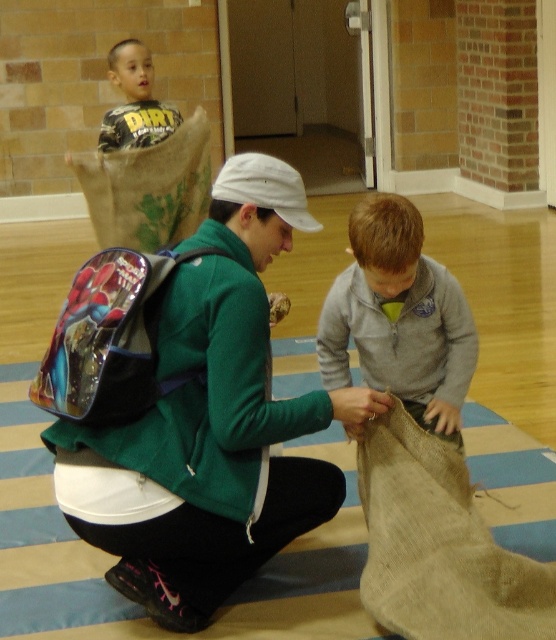
Question: Is green fabric backpack at center wider than gray fleece sweater at center?

Choices:
 (A) yes
 (B) no

Answer: (A)

Question: Which of the following is the farthest from the observer?

Choices:
 (A) (172, 129)
 (B) (358, 216)
 (C) (118, 337)
 (D) (212, 380)

Answer: (A)

Question: Which object appears closest to the camera in this image?

Choices:
 (A) matte yellow shirt at upper left
 (B) gray fleece sweater at center
 (C) shiny blue backpack at center

Answer: (C)

Question: Which object is closer to the camera taking this photo?

Choices:
 (A) gray fleece sweater at center
 (B) green fabric backpack at center
 (C) matte yellow shirt at upper left
 (D) shiny blue backpack at center

Answer: (D)

Question: Can you confirm if green fabric backpack at center is positioned below matte yellow shirt at upper left?

Choices:
 (A) no
 (B) yes

Answer: (B)

Question: Can you confirm if green fabric backpack at center is positioned to the left of matte yellow shirt at upper left?

Choices:
 (A) no
 (B) yes

Answer: (A)